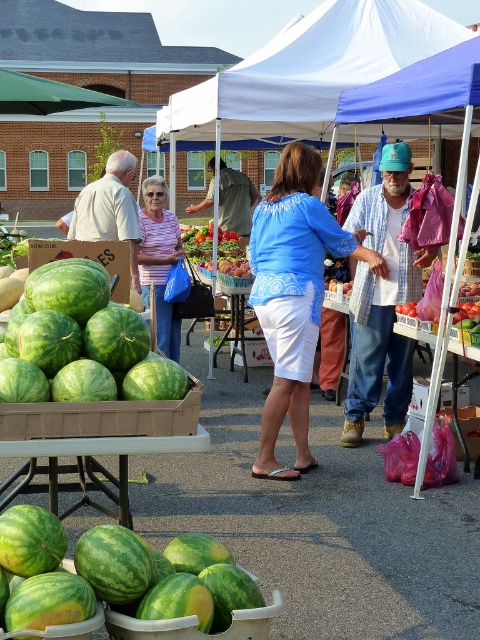
From the picture: You are standing at the entrance of the market and see a person wearing a blue plaid shirt at center and a camera. Which object is closer to you?

The blue plaid shirt at center is closer to you than the camera since they are 5.88 meters apart.